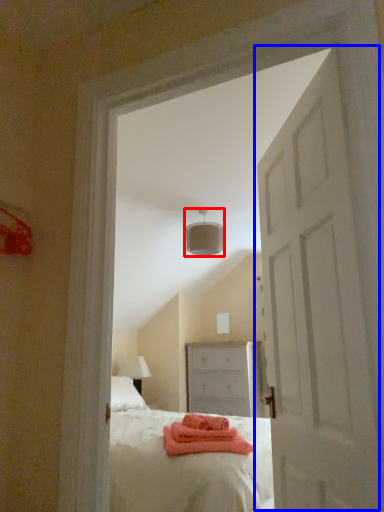
Question: Which of the following is the farthest to the observer, lamp (highlighted by a red box) or door (highlighted by a blue box)?

Choices:
 (A) lamp
 (B) door

Answer: (A)